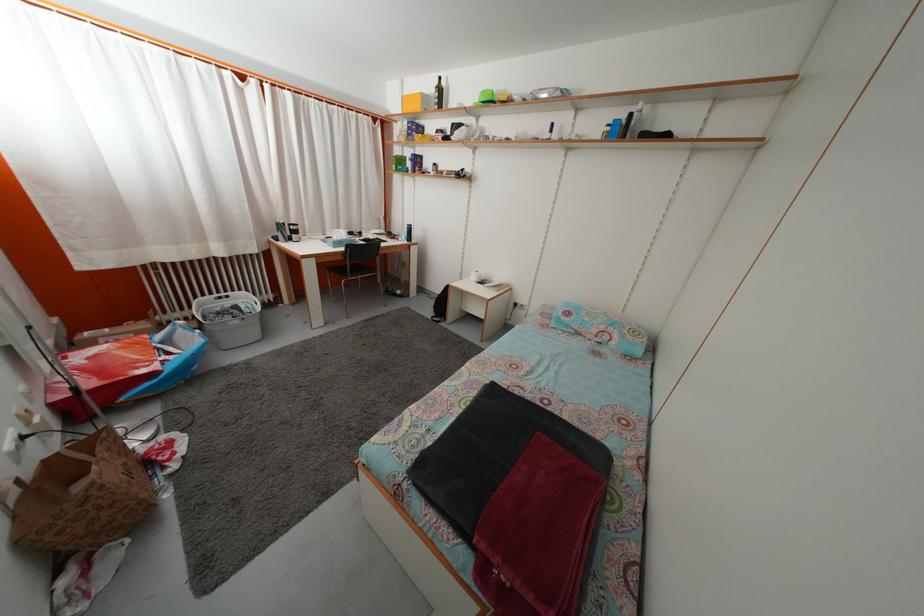
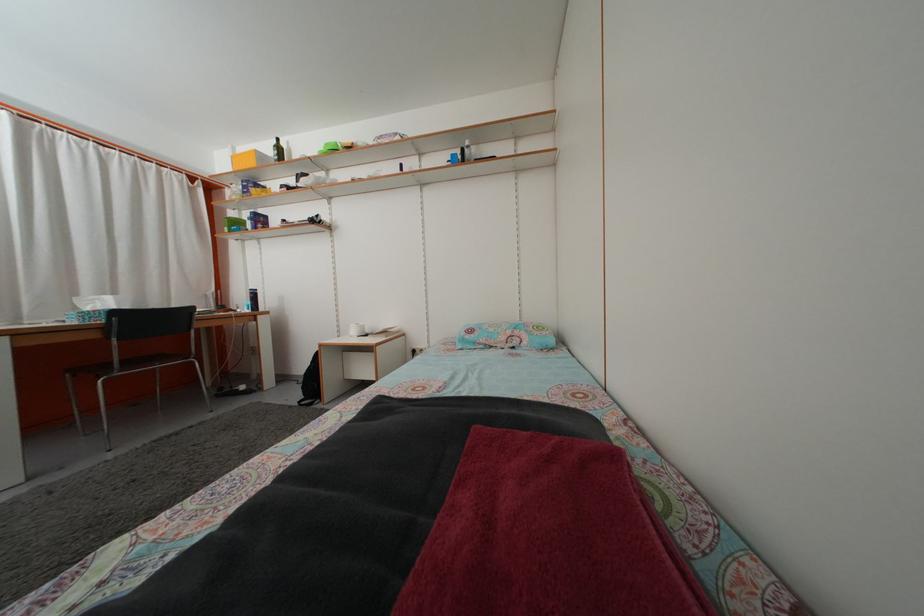
The point at (440, 322) is marked in the first image. Where is the corresponding point in the second image?

(309, 405)